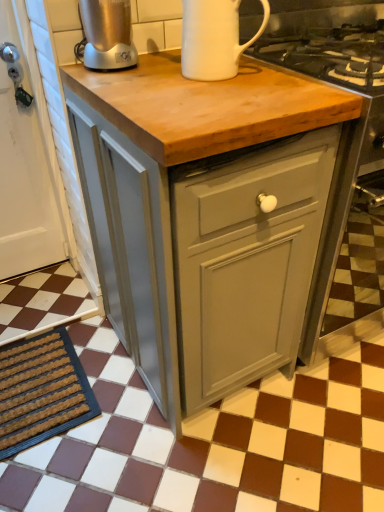
Where is `vacant area to the right of white ceramic mug at upper center, the first kitchen appliance from the right`? vacant area to the right of white ceramic mug at upper center, the first kitchen appliance from the right is located at coordinates (271, 72).